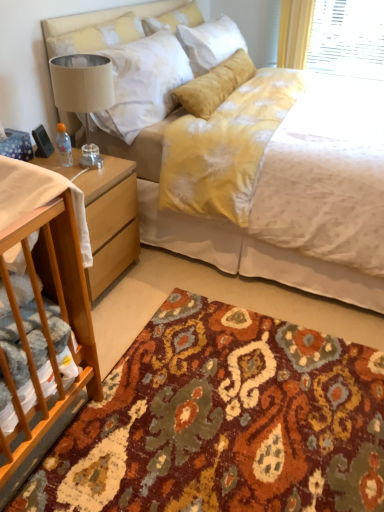
Question: Looking at their shapes, would you say light brown wood nightstand at lower left is wider or thinner than white fabric at left?

Choices:
 (A) thin
 (B) wide

Answer: (B)

Question: Is light brown wood nightstand at lower left in front of or behind white fabric at left in the image?

Choices:
 (A) behind
 (B) front

Answer: (A)

Question: Estimate the real-world distances between objects in this image. Which object is closer to the multicolored woven rug at lower center?

Choices:
 (A) light brown wood nightstand at lower left
 (B) white fabric at left
 (C) beige fabric lampshade at left
 (D) yellow fabric bed at center
 (E) soft yellow pillow at upper center

Answer: (D)

Question: Which object is the farthest from the multicolored woven rug at lower center?

Choices:
 (A) soft yellow pillow at upper center
 (B) yellow fabric bed at center
 (C) light brown wood nightstand at lower left
 (D) beige fabric lampshade at left
 (E) white fabric at left

Answer: (A)